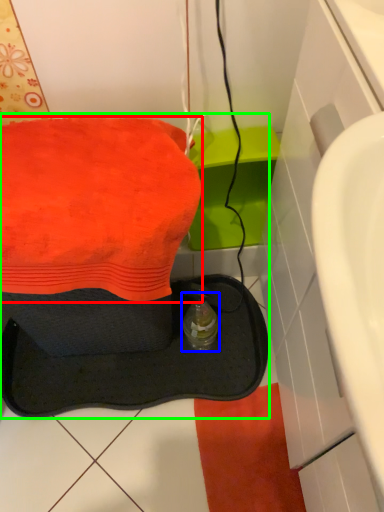
Question: Based on their relative distances, which object is farther from towel (highlighted by a red box)? Choose from bottle (highlighted by a blue box) and sink (highlighted by a green box).

Choices:
 (A) bottle
 (B) sink

Answer: (B)